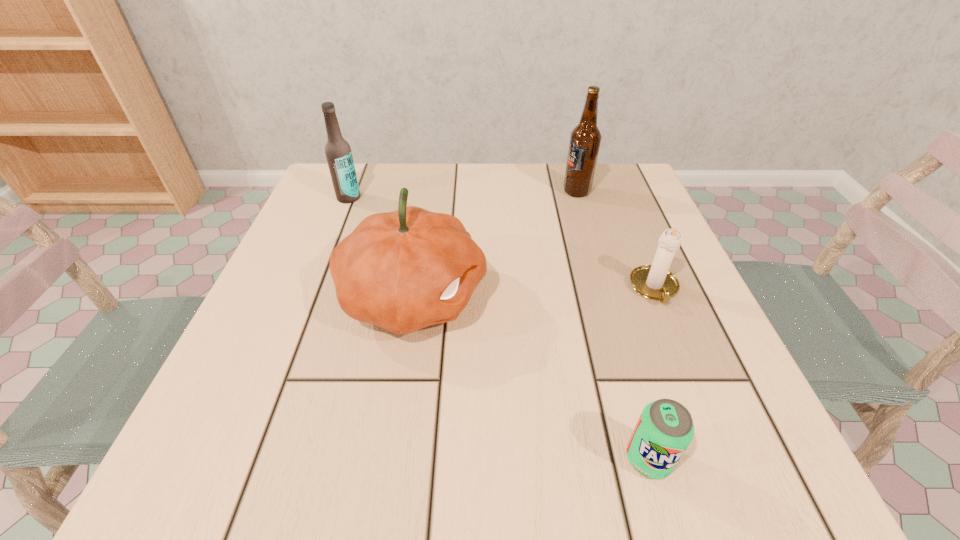
The image size is (960, 540). Identify the location of the right beer bottle. (585, 139).

Identify the location of the left beer bottle. (338, 152).

The image size is (960, 540). I want to click on pumpkin, so click(404, 270).

You are a GUI agent. You are given a task and a screenshot of the screen. Output one action in this format:
    pyautogui.click(x=<x>, y=<y>)
    Task: Click on the fourth tallest object
    Image resolution: width=960 pixels, height=540 pixels.
    Given the screenshot: What is the action you would take?
    pyautogui.click(x=655, y=282)

Locate an element on the screen. Image resolution: width=960 pixels, height=540 pixels. candle holder is located at coordinates (655, 282).

Find the location of a particular element. the nearest object is located at coordinates (665, 428).

The width and height of the screenshot is (960, 540). Identify the location of pop soda. (665, 428).

This screenshot has height=540, width=960. I want to click on free space located on the label of the right beer bottle, so click(x=542, y=192).

Where is `free location located 0.320m on the label of the right beer bottle`? The width and height of the screenshot is (960, 540). free location located 0.320m on the label of the right beer bottle is located at coordinates (428, 192).

This screenshot has height=540, width=960. Find the location of `vacant region located on the label of the right beer bottle`. vacant region located on the label of the right beer bottle is located at coordinates (500, 192).